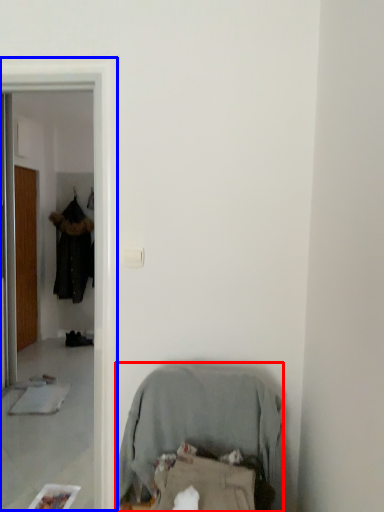
Question: Which point is closer to the camera, furniture (highlighted by a red box) or screen door (highlighted by a blue box)?

Choices:
 (A) furniture
 (B) screen door

Answer: (A)